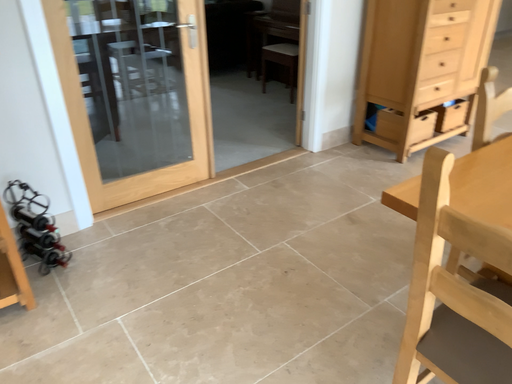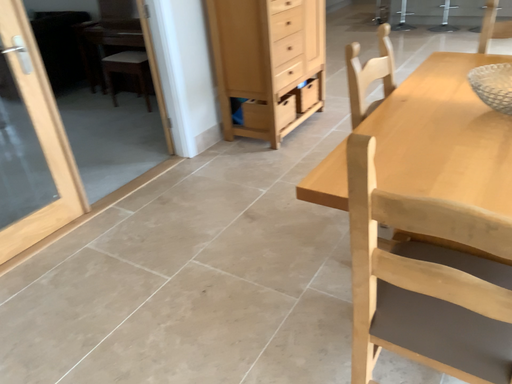
Question: Which way did the camera rotate in the video?

Choices:
 (A) rotated right
 (B) rotated left

Answer: (A)